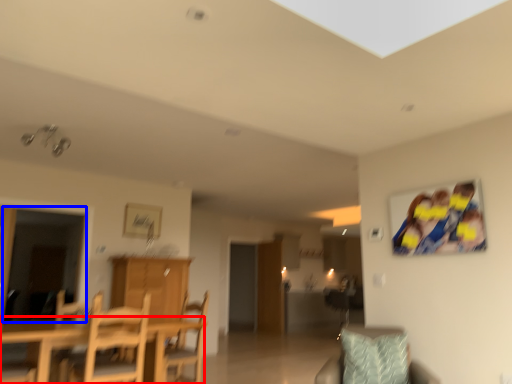
Question: Which of the following is the farthest to the observer, table (highlighted by a red box) or glass door (highlighted by a blue box)?

Choices:
 (A) table
 (B) glass door

Answer: (B)